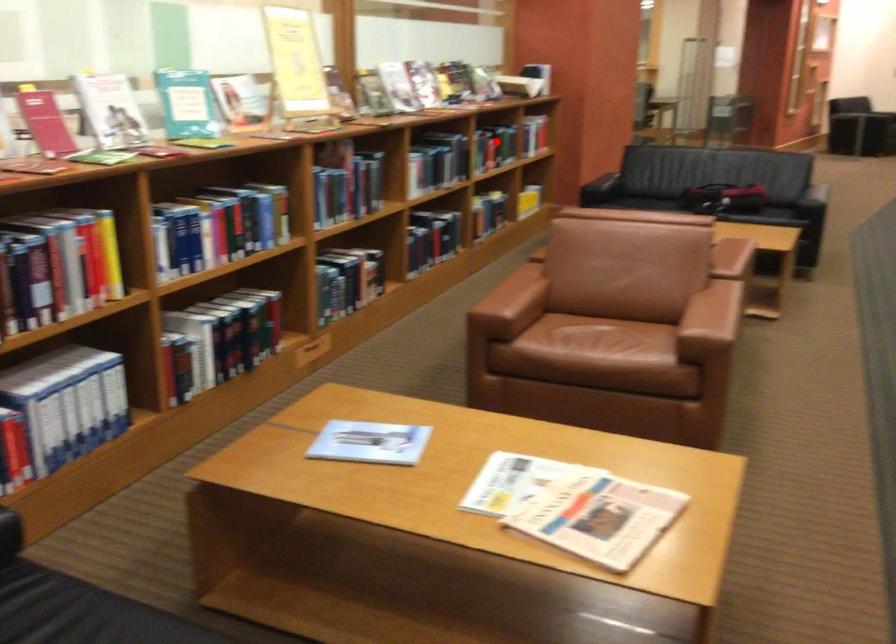
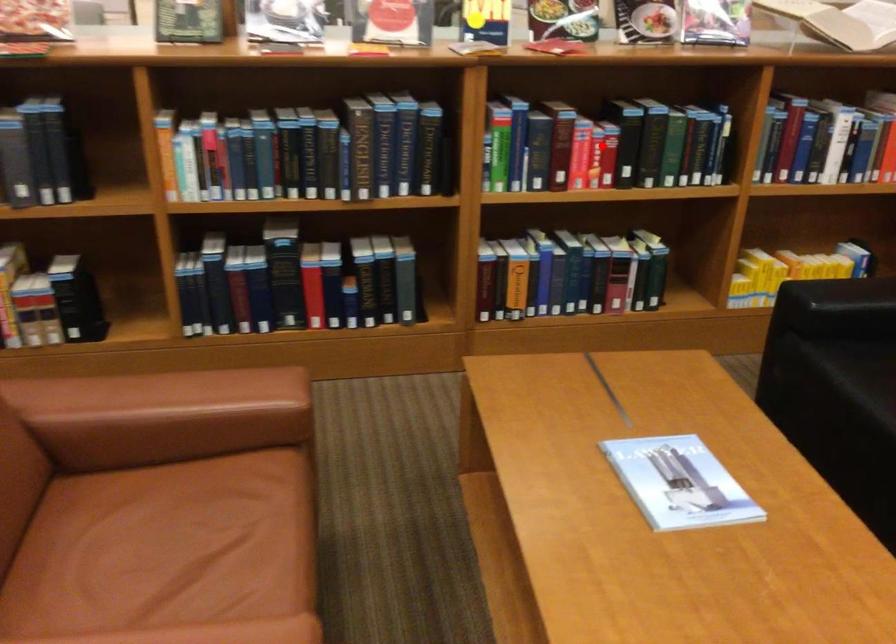
I am providing you with two images of the same scene from different viewpoints. A red point is marked on the first image and another point is marked on the second image. Are the points marked in image1 and image2 representing the same 3D position?

Yes